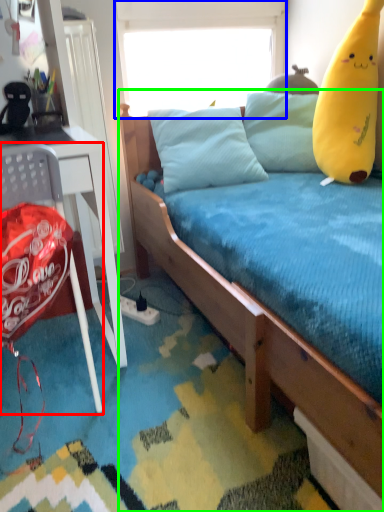
Question: Which object is the farthest from chair (highlighted by a red box)? Choose among these: window screen (highlighted by a blue box) or bed (highlighted by a green box).

Choices:
 (A) window screen
 (B) bed

Answer: (A)